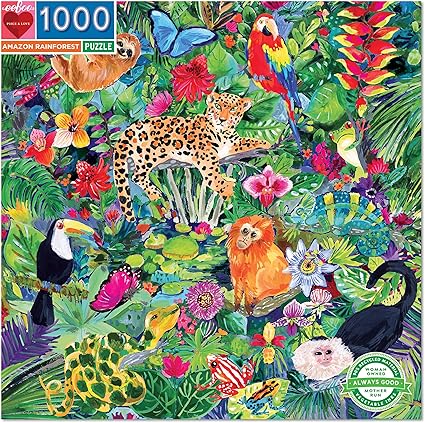
Identify the location of orchid. This screenshot has width=425, height=423. (291, 322), (268, 345), (38, 145), (267, 187).